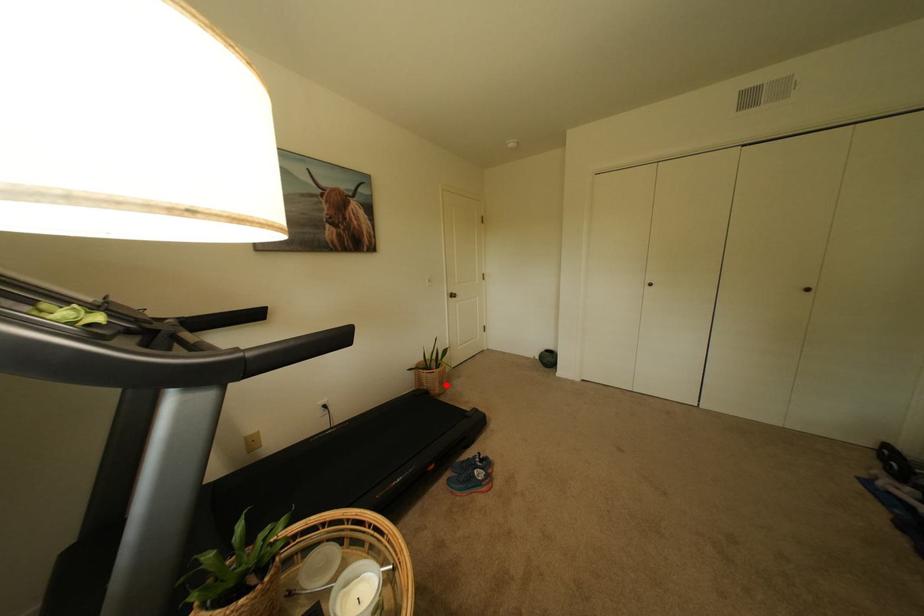
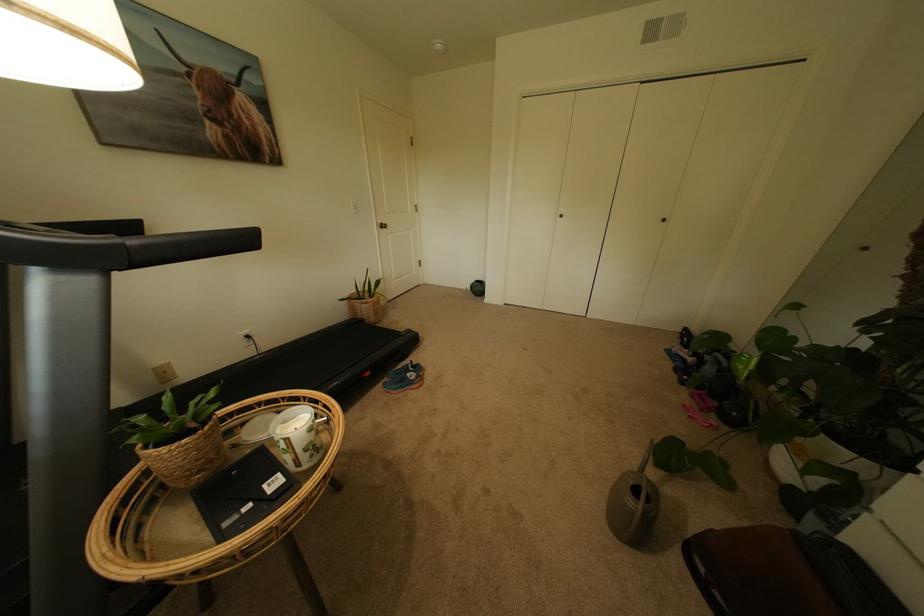
Question: I am providing you with two images of the same scene from different viewpoints. In image1, a red point is highlighted. Considering the same 3D point in image2, which of the following is correct?

Choices:
 (A) It is closer
 (B) It is farther

Answer: (A)